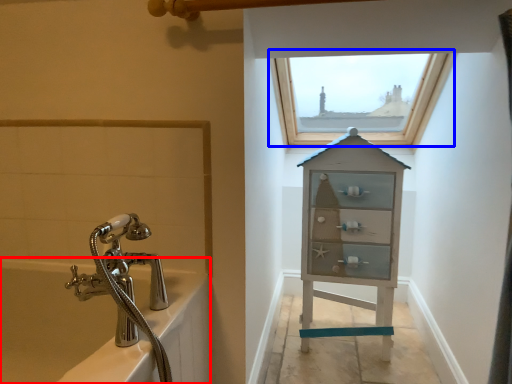
Question: Which point is closer to the camera, bath (highlighted by a red box) or window (highlighted by a blue box)?

Choices:
 (A) bath
 (B) window

Answer: (A)